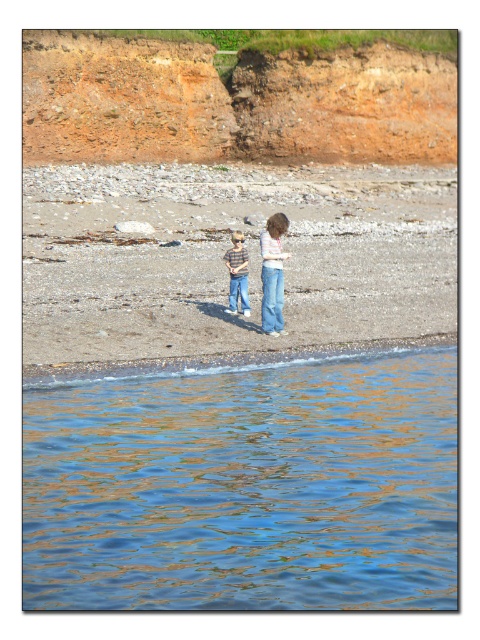
Question: Observing the image, what is the correct spatial positioning of white cotton shirt at center in reference to blue denim jeans at center?

Choices:
 (A) below
 (B) above

Answer: (A)

Question: Is blue liquid water at lower left bigger than smooth sand beach at center?

Choices:
 (A) no
 (B) yes

Answer: (A)

Question: Estimate the real-world distances between objects in this image. Which object is farther from the blue denim jeans at center?

Choices:
 (A) white cotton shirt at center
 (B) jeans at center
 (C) blue liquid water at lower left
 (D) striped shirt jeans at center

Answer: (C)

Question: Is blue liquid water at lower left thinner than white cotton shirt at center?

Choices:
 (A) no
 (B) yes

Answer: (A)

Question: Which object is farther from the camera taking this photo?

Choices:
 (A) striped shirt jeans at center
 (B) white cotton shirt at center
 (C) jeans at center

Answer: (A)

Question: Which point is closer to the camera?

Choices:
 (A) (83, 305)
 (B) (240, 273)

Answer: (A)